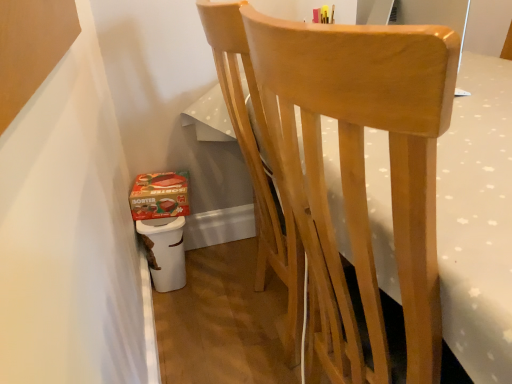
Question: Is white plastic potty at lower left at the back of matte cardboard box at lower left?

Choices:
 (A) yes
 (B) no

Answer: (B)

Question: Can you confirm if matte cardboard box at lower left is thinner than white plastic potty at lower left?

Choices:
 (A) no
 (B) yes

Answer: (B)

Question: Is matte cardboard box at lower left facing towards white plastic potty at lower left?

Choices:
 (A) no
 (B) yes

Answer: (A)

Question: Is matte cardboard box at lower left positioned behind white plastic potty at lower left?

Choices:
 (A) no
 (B) yes

Answer: (B)

Question: Would you say matte cardboard box at lower left is outside white plastic potty at lower left?

Choices:
 (A) yes
 (B) no

Answer: (A)

Question: From a real-world perspective, is matte cardboard box at lower left physically below white plastic potty at lower left?

Choices:
 (A) yes
 (B) no

Answer: (B)

Question: Considering the relative sizes of natural wood chair at center and white plastic potty at lower left in the image provided, is natural wood chair at center shorter than white plastic potty at lower left?

Choices:
 (A) no
 (B) yes

Answer: (A)

Question: Can you confirm if natural wood chair at center is positioned to the right of white plastic potty at lower left?

Choices:
 (A) yes
 (B) no

Answer: (A)

Question: Is natural wood chair at center with white plastic potty at lower left?

Choices:
 (A) yes
 (B) no

Answer: (B)

Question: From the image's perspective, is natural wood chair at center below white plastic potty at lower left?

Choices:
 (A) no
 (B) yes

Answer: (A)

Question: Is natural wood chair at center positioned beyond the bounds of white plastic potty at lower left?

Choices:
 (A) yes
 (B) no

Answer: (A)

Question: Does natural wood chair at center have a greater height compared to white plastic potty at lower left?

Choices:
 (A) yes
 (B) no

Answer: (A)

Question: Is white plastic potty at lower left positioned with its back to matte cardboard box at lower left?

Choices:
 (A) no
 (B) yes

Answer: (A)